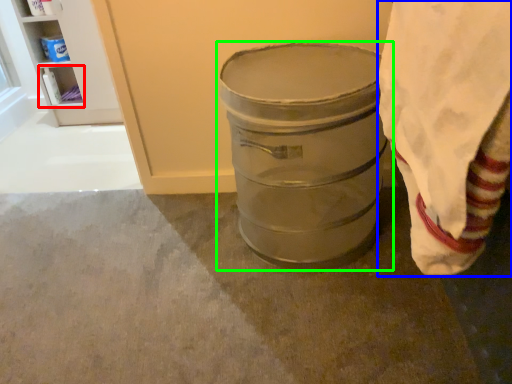
Question: Which object is positioned closest to shelf (highlighted by a red box)? Select from cloth (highlighted by a blue box) and waste container (highlighted by a green box).

Choices:
 (A) cloth
 (B) waste container

Answer: (B)